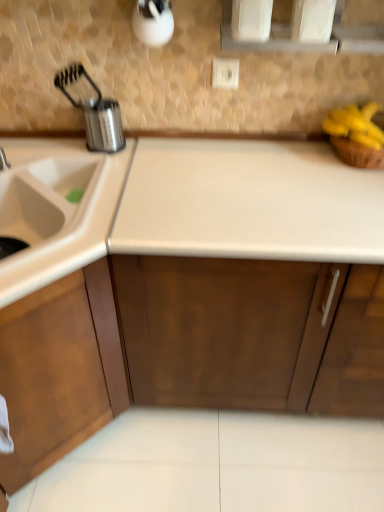
Where is `vacant space in between metallic silver canister at upper left and brushed metal faucet at left`? The height and width of the screenshot is (512, 384). vacant space in between metallic silver canister at upper left and brushed metal faucet at left is located at coordinates (56, 156).